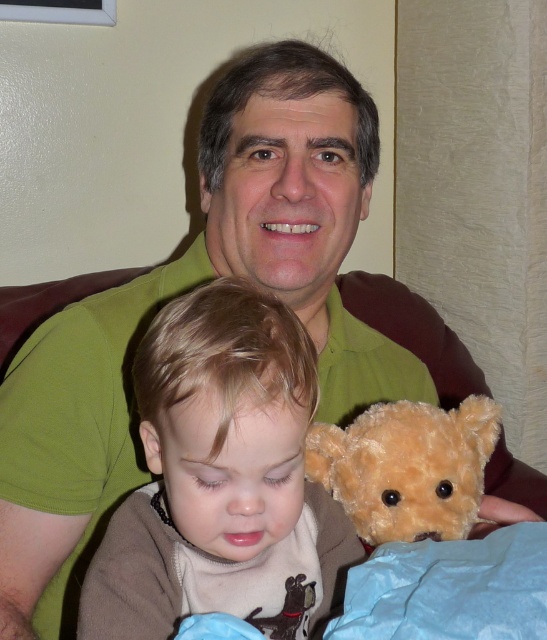
Question: Among these objects, which one is farthest from the camera?

Choices:
 (A) soft brown teddy bear at center
 (B) fuzzy brown teddy bear at center

Answer: (B)

Question: Which point appears closest to the camera in this image?

Choices:
 (A) (426, 483)
 (B) (327, 598)

Answer: (B)

Question: Which object appears closest to the camera in this image?

Choices:
 (A) soft brown teddy bear at center
 (B) fuzzy brown teddy bear at center

Answer: (A)

Question: Is soft brown teddy bear at center thinner than fuzzy brown teddy bear at center?

Choices:
 (A) no
 (B) yes

Answer: (A)

Question: Is soft brown teddy bear at center wider than fuzzy brown teddy bear at center?

Choices:
 (A) yes
 (B) no

Answer: (A)

Question: Does soft brown teddy bear at center appear on the left side of fuzzy brown teddy bear at center?

Choices:
 (A) yes
 (B) no

Answer: (A)